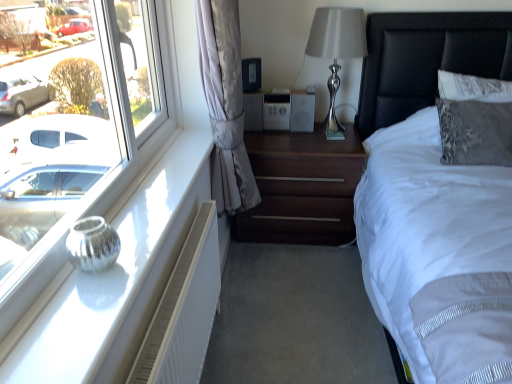
Question: Considering the relative positions of black leather headboard at upper right and silver metallic vase at left in the image provided, is black leather headboard at upper right behind silver metallic vase at left?

Choices:
 (A) yes
 (B) no

Answer: (A)

Question: Would you say black leather headboard at upper right is outside silver metallic vase at left?

Choices:
 (A) no
 (B) yes

Answer: (B)

Question: From a real-world perspective, is black leather headboard at upper right on silver metallic vase at left?

Choices:
 (A) no
 (B) yes

Answer: (B)

Question: Is silver metallic vase at left completely or partially inside black leather headboard at upper right?

Choices:
 (A) yes
 (B) no

Answer: (B)

Question: Does black leather headboard at upper right come in front of silver metallic vase at left?

Choices:
 (A) no
 (B) yes

Answer: (A)

Question: Considering the relative sizes of black leather headboard at upper right and silver metallic vase at left in the image provided, is black leather headboard at upper right smaller than silver metallic vase at left?

Choices:
 (A) no
 (B) yes

Answer: (A)

Question: Is white textured radiator at lower left not inside white fabric bed at right?

Choices:
 (A) no
 (B) yes

Answer: (B)

Question: Considering the relative sizes of white textured radiator at lower left and white fabric bed at right in the image provided, is white textured radiator at lower left shorter than white fabric bed at right?

Choices:
 (A) no
 (B) yes

Answer: (B)

Question: Does white textured radiator at lower left have a smaller size compared to white fabric bed at right?

Choices:
 (A) yes
 (B) no

Answer: (A)

Question: Is there a large distance between white textured radiator at lower left and white fabric bed at right?

Choices:
 (A) yes
 (B) no

Answer: (A)

Question: Considering the relative sizes of white textured radiator at lower left and white fabric bed at right in the image provided, is white textured radiator at lower left wider than white fabric bed at right?

Choices:
 (A) yes
 (B) no

Answer: (B)

Question: Is white textured radiator at lower left at the right side of white fabric bed at right?

Choices:
 (A) no
 (B) yes

Answer: (A)

Question: Is white fabric bed at right further to the viewer compared to satin silver lamp at upper right?

Choices:
 (A) yes
 (B) no

Answer: (B)